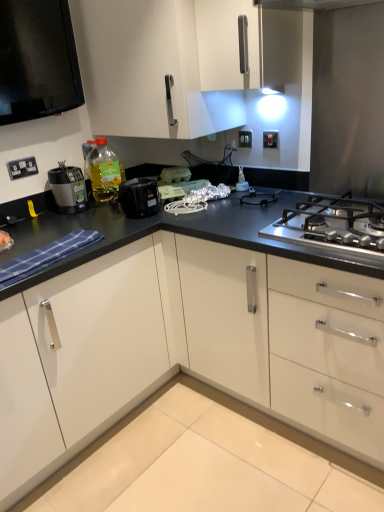
This screenshot has width=384, height=512. What are the coordinates of `matte black food processor at left` in the screenshot? It's located at (68, 188).

Image resolution: width=384 pixels, height=512 pixels. What do you see at coordinates (333, 225) in the screenshot? I see `stainless steel gas stove at right` at bounding box center [333, 225].

Identify the location of stainless steel gas stove at right. The width and height of the screenshot is (384, 512). coord(333,225).

Measure the distance between white plastic electrical outlet at upper left, the 1th electric outlet when ordered from bottom to top, and camera.

white plastic electrical outlet at upper left, the 1th electric outlet when ordered from bottom to top, is 6.36 feet from camera.

This screenshot has width=384, height=512. Describe the element at coordinates (245, 139) in the screenshot. I see `white plastic electric outlet at upper center, marked as the third electric outlet in a front-to-back arrangement` at that location.

This screenshot has width=384, height=512. I want to click on white plastic switch at upper right, which is the second electric outlet in top-to-bottom order, so click(270, 139).

Considering the positions of objects white plastic electric outlet at upper center, which is counted as the first electric outlet, starting from the back, and translucent yellow bottle at upper left in the image provided, who is more to the left, white plastic electric outlet at upper center, which is counted as the first electric outlet, starting from the back, or translucent yellow bottle at upper left?

Positioned to the left is translucent yellow bottle at upper left.

Is white plastic electric outlet at upper center, marked as the third electric outlet in a front-to-back arrangement, facing towards translucent yellow bottle at upper left?

No.

Is point (251, 136) closer or farther from the camera than point (101, 184)?

Clearly, point (251, 136) is more distant from the camera than point (101, 184).

Is stainless steel gas stove at right with white glossy cabinet at upper center?

No, stainless steel gas stove at right is not in contact with white glossy cabinet at upper center.

In the scene shown: Can you confirm if stainless steel gas stove at right is thinner than white glossy cabinet at upper center?

No, stainless steel gas stove at right is not thinner than white glossy cabinet at upper center.

Is stainless steel gas stove at right at the left side of white glossy cabinet at upper center?

Incorrect, stainless steel gas stove at right is not on the left side of white glossy cabinet at upper center.

From a real-world perspective, is stainless steel gas stove at right located higher than white glossy cabinet at upper center?

Actually, stainless steel gas stove at right is physically below white glossy cabinet at upper center in the real world.

From a real-world perspective, is white plastic toaster at center, the 2th appliance from the left, positioned above or below stainless steel gas stove at right?

white plastic toaster at center, the 2th appliance from the left, is situated higher than stainless steel gas stove at right in the real world.

How different are the orientations of white plastic toaster at center, arranged as the second appliance when viewed from the right, and stainless steel gas stove at right in degrees?

58.7 degrees separate the facing orientations of white plastic toaster at center, arranged as the second appliance when viewed from the right, and stainless steel gas stove at right.

Considering the positions of objects white plastic toaster at center, arranged as the second appliance when viewed from the right, and stainless steel gas stove at right in the image provided, who is in front, white plastic toaster at center, arranged as the second appliance when viewed from the right, or stainless steel gas stove at right?

stainless steel gas stove at right is closer to the camera.

Does white plastic toaster at center, arranged as the second appliance when viewed from the right, have a smaller size compared to stainless steel gas stove at right?

Yes.

From a real-world perspective, is matte plastic kettle at center, the third appliance when ordered from left to right, positioned over translucent yellow bottle at upper left based on gravity?

No, from a real-world perspective, matte plastic kettle at center, the third appliance when ordered from left to right, is not above translucent yellow bottle at upper left.

Considering the sizes of objects matte plastic kettle at center, which appears as the first appliance when viewed from the right, and translucent yellow bottle at upper left in the image provided, who is smaller, matte plastic kettle at center, which appears as the first appliance when viewed from the right, or translucent yellow bottle at upper left?

matte plastic kettle at center, which appears as the first appliance when viewed from the right.

What's the angular difference between matte plastic kettle at center, the third appliance when ordered from left to right, and translucent yellow bottle at upper left's facing directions?

There is a 63.1-degree angle between the facing directions of matte plastic kettle at center, the third appliance when ordered from left to right, and translucent yellow bottle at upper left.

Does matte plastic kettle at center, which appears as the first appliance when viewed from the right, have a greater width compared to translucent yellow bottle at upper left?

In fact, matte plastic kettle at center, which appears as the first appliance when viewed from the right, might be narrower than translucent yellow bottle at upper left.

Can you confirm if white plastic toaster at center, the 2th appliance from the left, is positioned to the left of translucent yellow bottle at upper left?

No.

Looking at this image, is white plastic toaster at center, arranged as the second appliance when viewed from the right, facing away from translucent yellow bottle at upper left?

No, white plastic toaster at center, arranged as the second appliance when viewed from the right, is not facing away from translucent yellow bottle at upper left.

Could translucent yellow bottle at upper left be considered to be inside white plastic toaster at center, arranged as the second appliance when viewed from the right?

Definitely not — translucent yellow bottle at upper left is not inside white plastic toaster at center, arranged as the second appliance when viewed from the right.

Considering the points (163, 181) and (265, 144), which point is behind, point (163, 181) or point (265, 144)?

The point (163, 181) is farther.

Between white plastic toaster at center, arranged as the second appliance when viewed from the right, and white plastic switch at upper right, which ranks as the first electric outlet in right-to-left order, which one has smaller size?

With smaller size is white plastic switch at upper right, which ranks as the first electric outlet in right-to-left order.

Is white plastic toaster at center, arranged as the second appliance when viewed from the right, far away from white plastic switch at upper right, the second electric outlet in the back-to-front sequence?

No, white plastic toaster at center, arranged as the second appliance when viewed from the right, is not far from white plastic switch at upper right, the second electric outlet in the back-to-front sequence.

What are the coordinates of `electric outlet that is the 2nd object to the right of the white plastic toaster at center, the 2th appliance from the left, starting at the anchor` in the screenshot? It's located at (270, 139).

From a real-world perspective, between white plastic electric outlet at upper center, which is the 2th electric outlet from left to right, and matte plastic container at center, acting as the 1th appliance starting from the left, who is vertically lower?

matte plastic container at center, acting as the 1th appliance starting from the left.

Can you confirm if white plastic electric outlet at upper center, the second electric outlet from the right, is shorter than matte plastic container at center, acting as the 1th appliance starting from the left?

Indeed, white plastic electric outlet at upper center, the second electric outlet from the right, has a lesser height compared to matte plastic container at center, acting as the 1th appliance starting from the left.

Could you measure the distance between white plastic electric outlet at upper center, the second electric outlet from the right, and matte plastic container at center, which is counted as the 3th appliance, starting from the right?

white plastic electric outlet at upper center, the second electric outlet from the right, and matte plastic container at center, which is counted as the 3th appliance, starting from the right, are 14.21 inches apart from each other.

Is white plastic electric outlet at upper center, which is the 2th electric outlet from left to right, turned away from matte plastic container at center, acting as the 1th appliance starting from the left?

No, white plastic electric outlet at upper center, which is the 2th electric outlet from left to right, is not facing the opposite direction of matte plastic container at center, acting as the 1th appliance starting from the left.

Locate an element on the screen. the 1st electric outlet to the right of the translucent yellow bottle at upper left, counting from the anchor's position is located at coordinates (245, 139).

The width and height of the screenshot is (384, 512). Find the location of `gas stove that is in front of the white glossy cabinet at upper center`. gas stove that is in front of the white glossy cabinet at upper center is located at coordinates (333, 225).

When comparing their distances from stainless steel gas stove at right, does black plastic slow cooker at center or matte plastic kettle at center, which appears as the first appliance when viewed from the right, seem further?

black plastic slow cooker at center is further to stainless steel gas stove at right.

When comparing their distances from translucent yellow bottle at upper left, does matte plastic kettle at center, the third appliance when ordered from left to right, or matte black food processor at left seem closer?

matte black food processor at left is closer to translucent yellow bottle at upper left.

Considering their positions, is matte plastic kettle at center, the third appliance when ordered from left to right, positioned further to white plastic electric outlet at upper center, marked as the 1th electric outlet in a top-to-bottom arrangement, than black plastic slow cooker at center?

black plastic slow cooker at center is further to white plastic electric outlet at upper center, marked as the 1th electric outlet in a top-to-bottom arrangement.

Looking at this image, which object lies nearer to the anchor point stainless steel gas stove at right, white glossy cabinet at upper center or white plastic toaster at center, arranged as the second appliance when viewed from the right?

white plastic toaster at center, arranged as the second appliance when viewed from the right, lies closer to stainless steel gas stove at right than the other object.

Which object lies nearer to the anchor point translucent yellow bottle at upper left, white plastic switch at upper right, which ranks as the first electric outlet in right-to-left order, or matte black food processor at left?

matte black food processor at left is positioned closer to the anchor translucent yellow bottle at upper left.

From the image, which object appears to be farther from white plastic toaster at center, arranged as the second appliance when viewed from the right, matte plastic kettle at center, the third appliance when ordered from left to right, or black plastic slow cooker at center?

matte plastic kettle at center, the third appliance when ordered from left to right, is further to white plastic toaster at center, arranged as the second appliance when viewed from the right.

Considering their positions, is white glossy cabinet at upper center positioned further to white plastic electrical outlet at upper left, the 1th electric outlet when ordered from bottom to top, than matte plastic kettle at center, the third appliance when ordered from left to right?

Based on the image, matte plastic kettle at center, the third appliance when ordered from left to right, appears to be further to white plastic electrical outlet at upper left, the 1th electric outlet when ordered from bottom to top.

From the image, which object appears to be farther from black plastic slow cooker at center, white glossy cabinet at upper center or matte plastic container at center, acting as the 1th appliance starting from the left?

white glossy cabinet at upper center is positioned further to the anchor black plastic slow cooker at center.

The width and height of the screenshot is (384, 512). What are the coordinates of `electric outlet between matte plastic container at center, which is counted as the 3th appliance, starting from the right, and white plastic switch at upper right, which ranks as the first electric outlet in right-to-left order` in the screenshot? It's located at (245, 139).

Find the location of a particular element. This screenshot has width=384, height=512. cabinetry located between white plastic electrical outlet at upper left, the 3th electric outlet positioned from the top, and matte plastic kettle at center, which appears as the first appliance when viewed from the right, in the left-right direction is located at coordinates (164, 65).

At what (x,y) coordinates should I click in order to perform the action: click on home appliance between white glossy cabinet at upper center and matte plastic container at center, acting as the 1th appliance starting from the left, from front to back. Please return your answer as a coordinate pair (x, y). Image resolution: width=384 pixels, height=512 pixels. Looking at the image, I should click on (68, 188).

This screenshot has width=384, height=512. What are the coordinates of `bottle located between white glossy cabinet at upper center and white plastic electric outlet at upper center, the second electric outlet from the right, in the depth direction` in the screenshot? It's located at (105, 172).